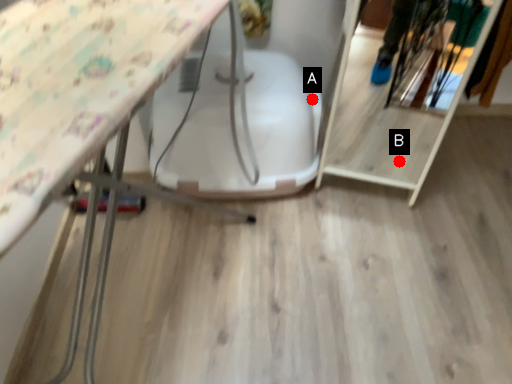
Question: Two points are circled on the image, labeled by A and B beside each circle. Which point is closer to the camera?

Choices:
 (A) A is closer
 (B) B is closer

Answer: (A)